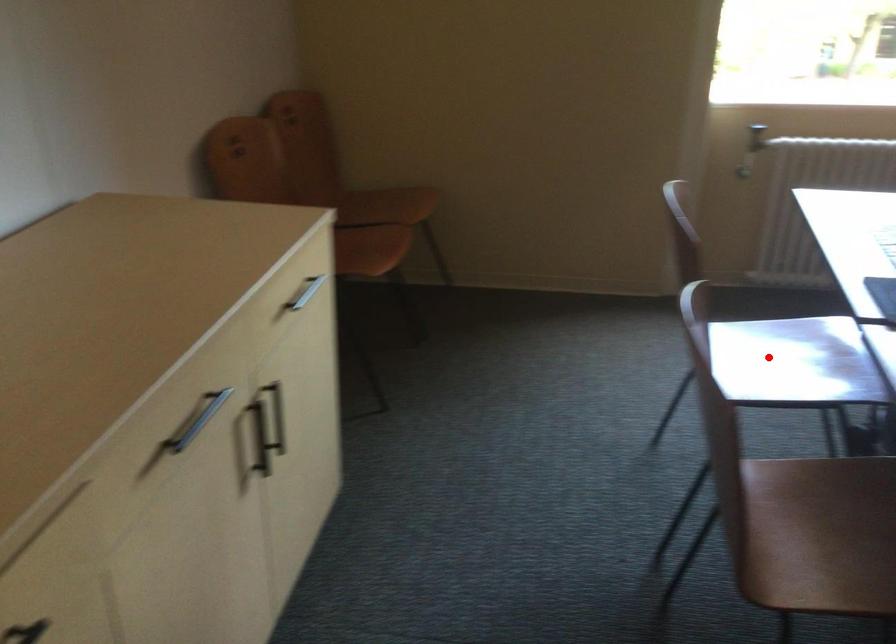
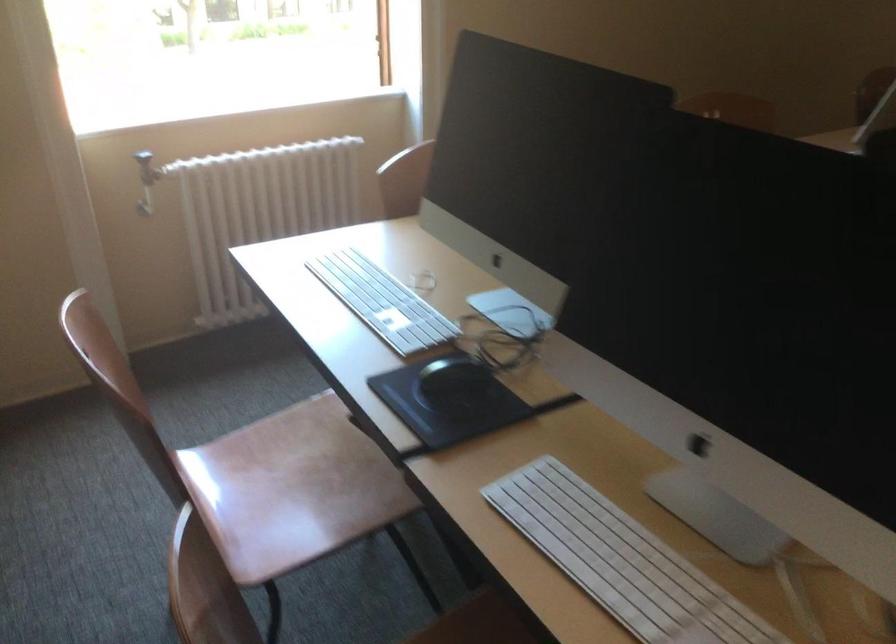
Question: I am providing you with two images of the same scene from different viewpoints. Given a red point in image1, look at the same physical point in image2. Is it:

Choices:
 (A) Closer to the viewpoint
 (B) Farther from the viewpoint

Answer: (A)